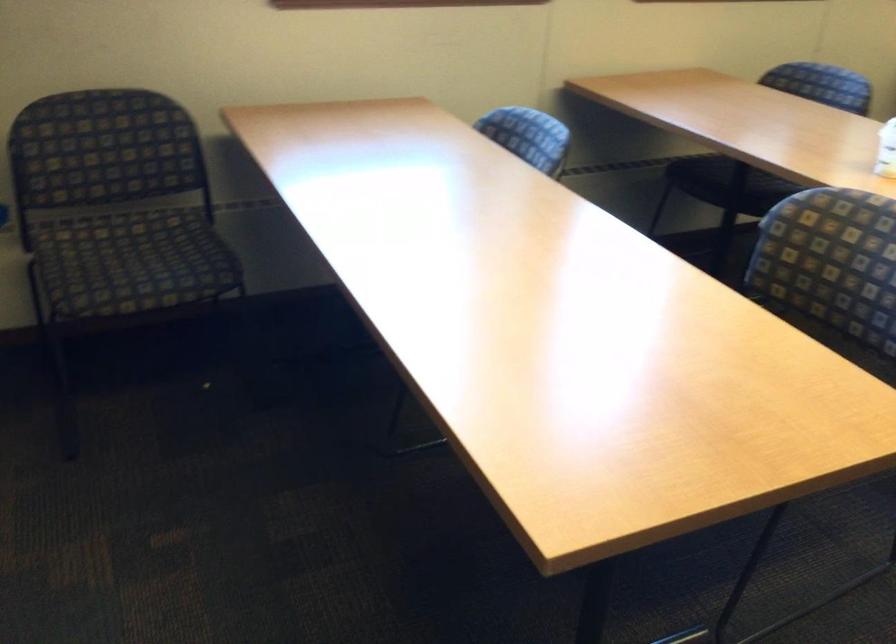
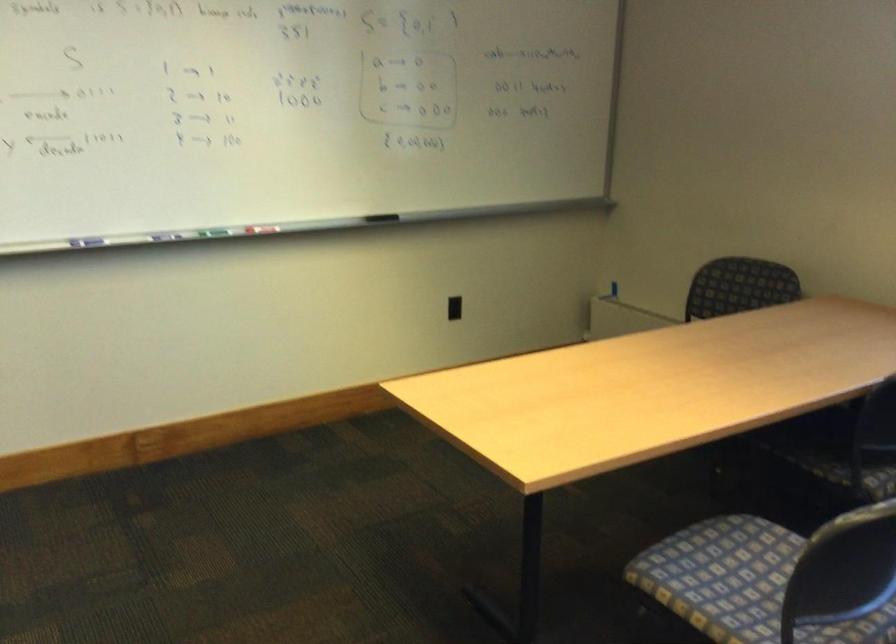
Question: I am providing you with two images of the same scene from different viewpoints. Which of the following objects are not visible in image2?

Choices:
 (A) chair sitting surface
 (B) black power outlet
 (C) red whiteboard marker
 (D) white wire hanger

Answer: (A)